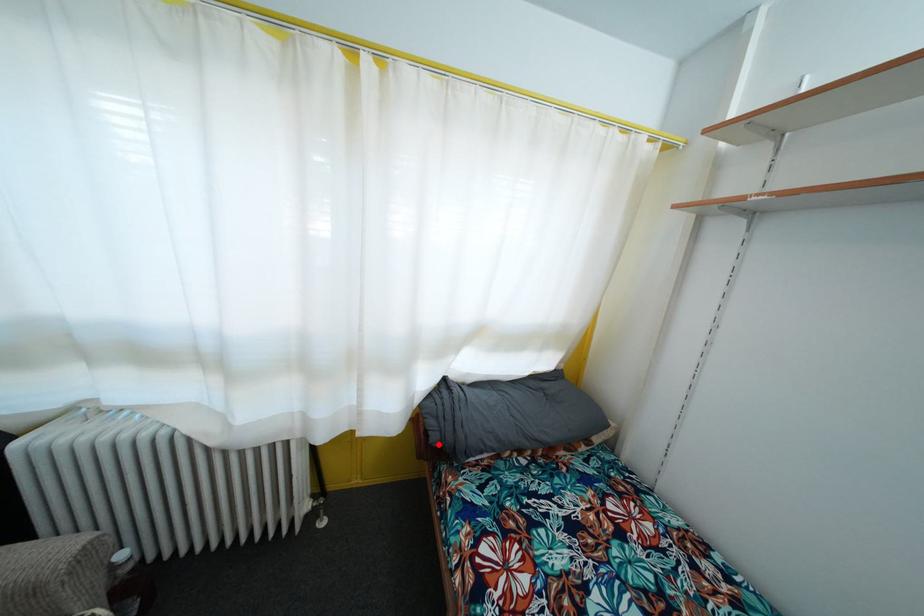
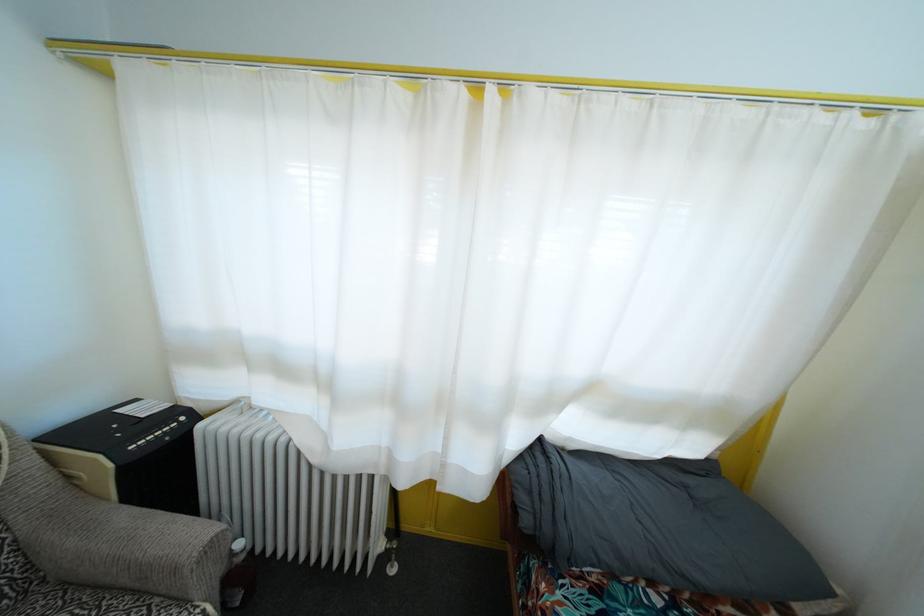
Question: I am providing you with two images of the same scene from different viewpoints. A red point is marked on the first image. Can you still see the location of the red point in image 2?

Choices:
 (A) Yes
 (B) No

Answer: (A)